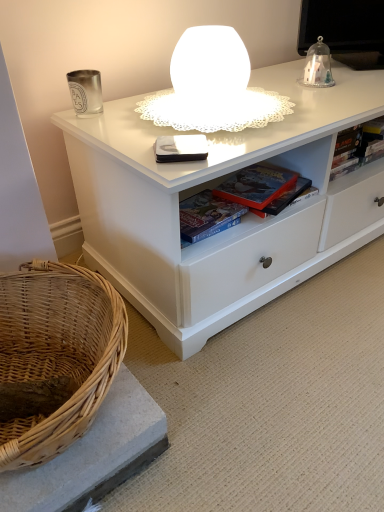
The height and width of the screenshot is (512, 384). Find the location of `free point above matte plastic book at center, the 2th book positioned from the back (from a real-world perspective)`. free point above matte plastic book at center, the 2th book positioned from the back (from a real-world perspective) is located at coordinates (257, 179).